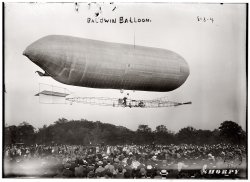
The image size is (250, 182). Identify the location of vintage photograph. (125, 38).